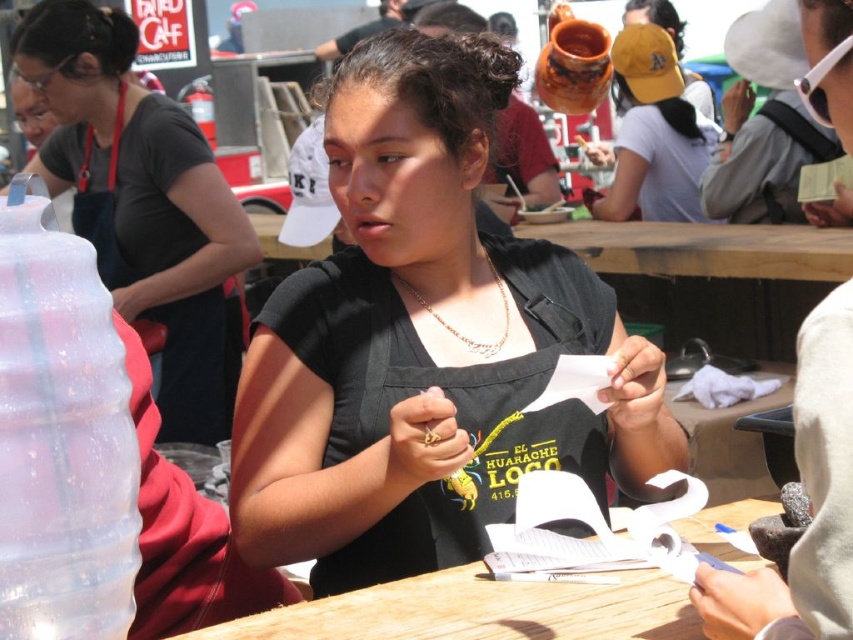
You are a vendor at the market and need to place a large container on the wooden table at center. However, there is a gold chain necklace at center on the table. Can the container fit on the table without overlapping the necklace?

The wooden table at center is bigger than the gold chain necklace at center, so the container can fit on the table without overlapping the necklace.

You are a photographer standing in the market and want to take a clear photo of both the wooden table at center and the gold chain necklace at center. Which object should you focus on first to ensure both are in focus?

The wooden table at center is closer to the viewer than the gold chain necklace at center. To ensure both are in focus, you should focus on the wooden table at center first.